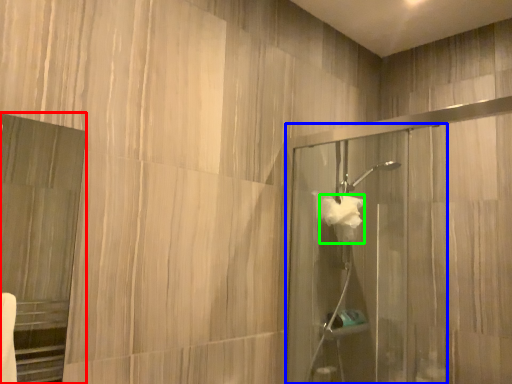
Question: Based on their relative distances, which object is nearer to screen door (highlighted by a red box)? Choose from screen door (highlighted by a blue box) and hand towel (highlighted by a green box).

Choices:
 (A) screen door
 (B) hand towel

Answer: (A)